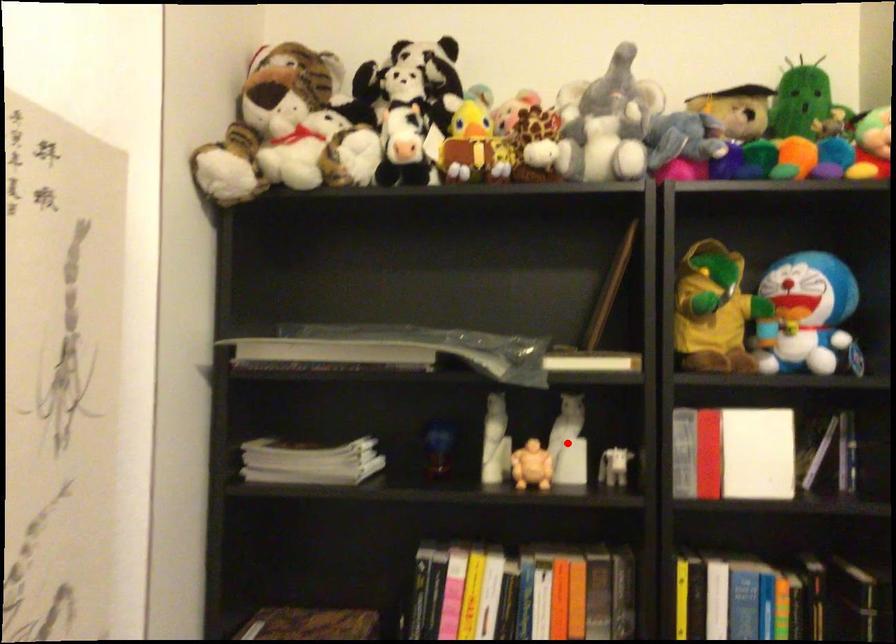
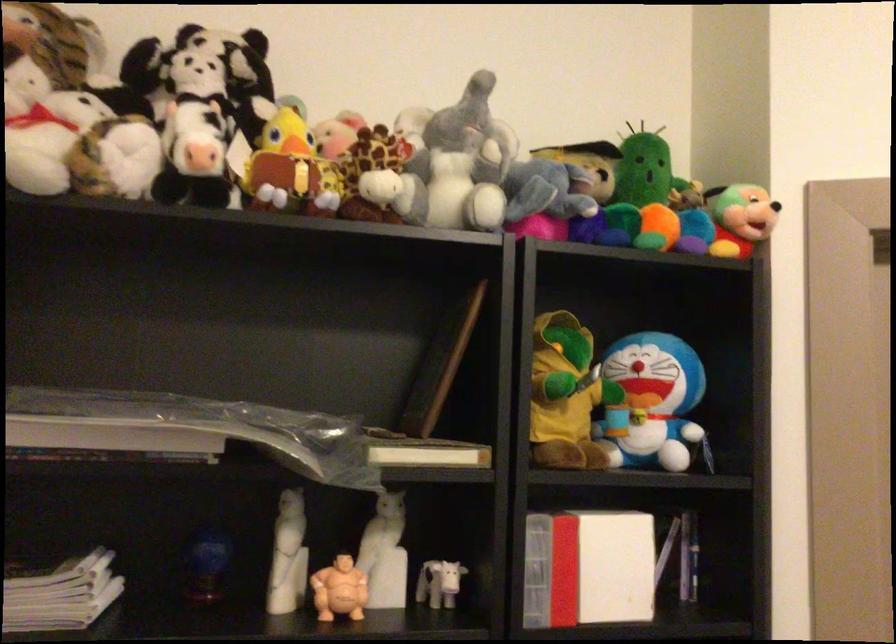
Locate, in the second image, the point that corresponds to the highlighted location in the first image.

(384, 554)